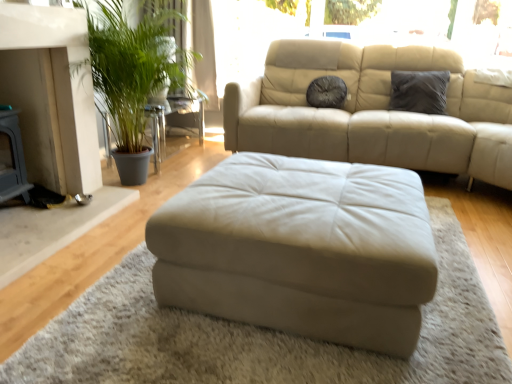
Question: Could green leafy plant at left be considered to be inside dark gray fabric pillow at upper right, the first pillow from the right?

Choices:
 (A) yes
 (B) no

Answer: (B)

Question: Considering the relative sizes of dark gray fabric pillow at upper right, the first pillow from the right, and green leafy plant at left in the image provided, is dark gray fabric pillow at upper right, the first pillow from the right, bigger than green leafy plant at left?

Choices:
 (A) no
 (B) yes

Answer: (A)

Question: Considering the relative positions of dark gray fabric pillow at upper right, which is counted as the second pillow, starting from the left, and green leafy plant at left in the image provided, is dark gray fabric pillow at upper right, which is counted as the second pillow, starting from the left, to the left of green leafy plant at left from the viewer's perspective?

Choices:
 (A) no
 (B) yes

Answer: (A)

Question: Is green leafy plant at left at the back of dark gray fabric pillow at upper right, the first pillow from the right?

Choices:
 (A) yes
 (B) no

Answer: (B)

Question: Is dark gray fabric pillow at upper right, the first pillow from the right, to the right of green leafy plant at left from the viewer's perspective?

Choices:
 (A) no
 (B) yes

Answer: (B)

Question: Could you tell me if dark gray fabric pillow at upper right, the first pillow from the right, is facing green leafy plant at left?

Choices:
 (A) yes
 (B) no

Answer: (B)

Question: From the image's perspective, is beige leather ottoman at center below dark gray textured pillow at center, the first pillow positioned from the left?

Choices:
 (A) yes
 (B) no

Answer: (A)

Question: From the image's perspective, would you say beige leather ottoman at center is positioned over dark gray textured pillow at center, the first pillow positioned from the left?

Choices:
 (A) yes
 (B) no

Answer: (B)

Question: Can you confirm if beige leather ottoman at center is taller than dark gray textured pillow at center, the 2th pillow when ordered from right to left?

Choices:
 (A) no
 (B) yes

Answer: (B)

Question: Is beige leather ottoman at center not inside dark gray textured pillow at center, the 2th pillow when ordered from right to left?

Choices:
 (A) yes
 (B) no

Answer: (A)

Question: Is beige leather ottoman at center positioned far away from dark gray textured pillow at center, the first pillow positioned from the left?

Choices:
 (A) no
 (B) yes

Answer: (B)

Question: From a real-world perspective, is beige leather ottoman at center over dark gray textured pillow at center, the first pillow positioned from the left?

Choices:
 (A) no
 (B) yes

Answer: (A)

Question: Is the surface of green leafy plant at left in direct contact with beige leather ottoman at center?

Choices:
 (A) yes
 (B) no

Answer: (B)